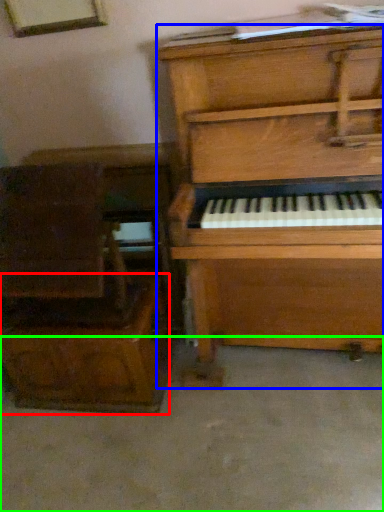
Question: Considering the real-world distances, which object is farthest from drawer (highlighted by a red box)? piano (highlighted by a blue box) or concrete (highlighted by a green box)?

Choices:
 (A) piano
 (B) concrete

Answer: (A)